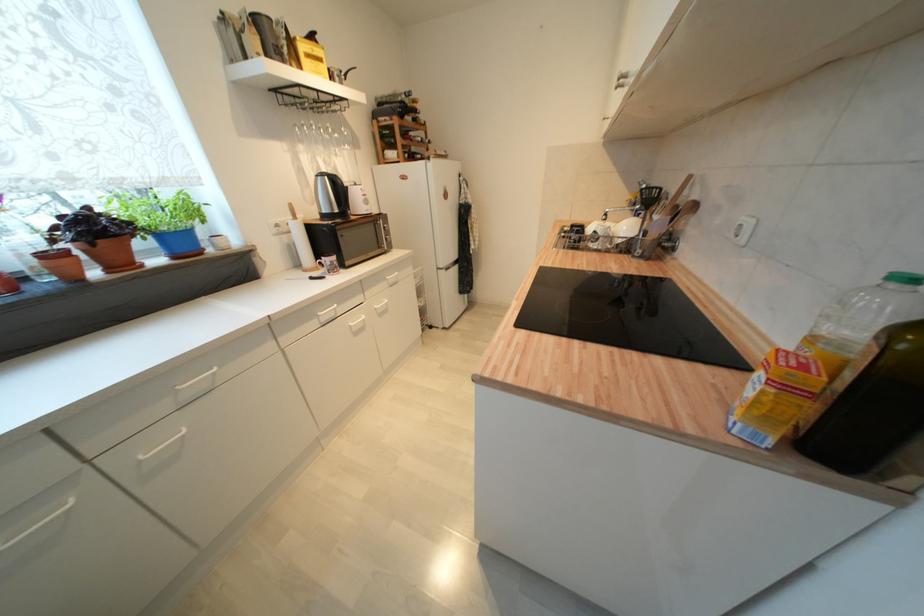
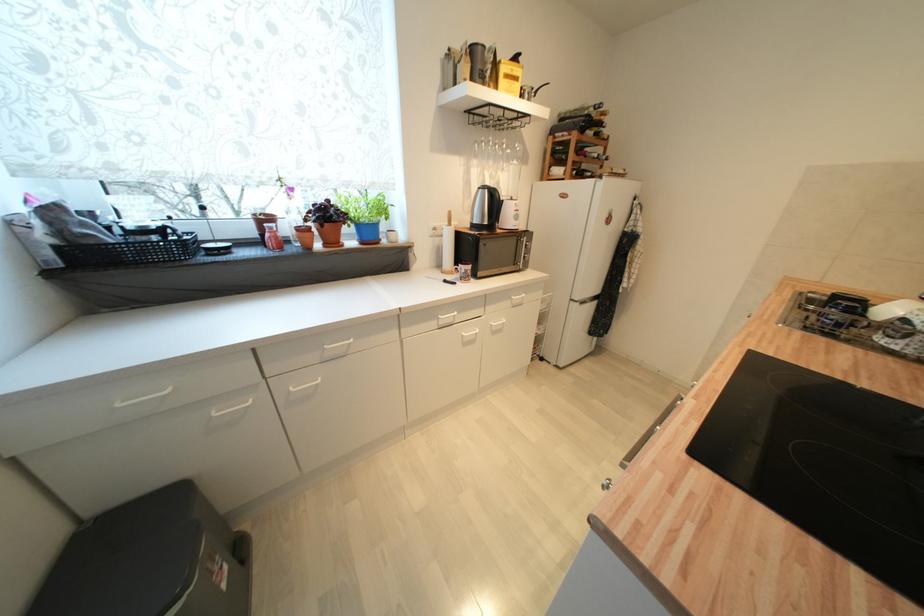
Where in the second image is the point corresponding to point (323, 318) from the first image?

(444, 321)